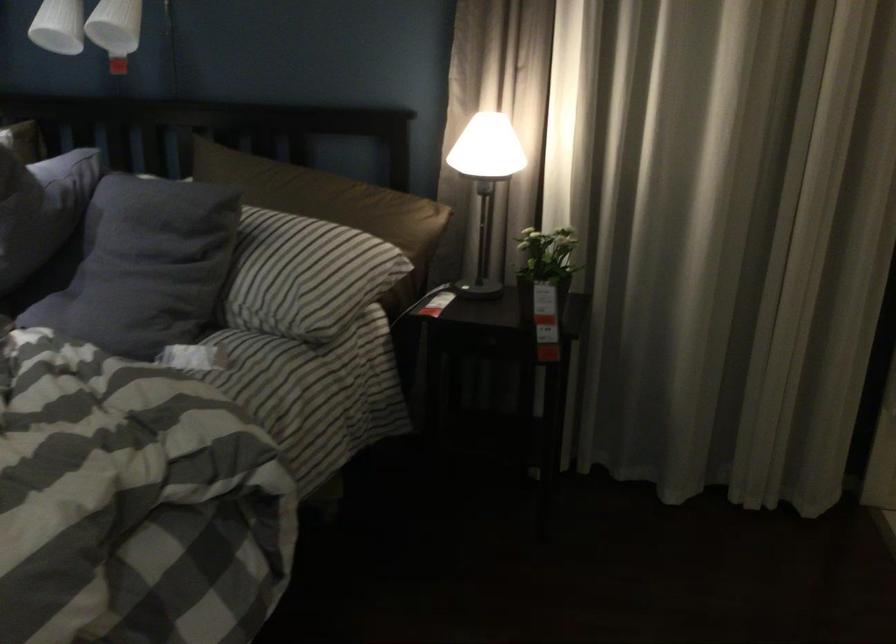
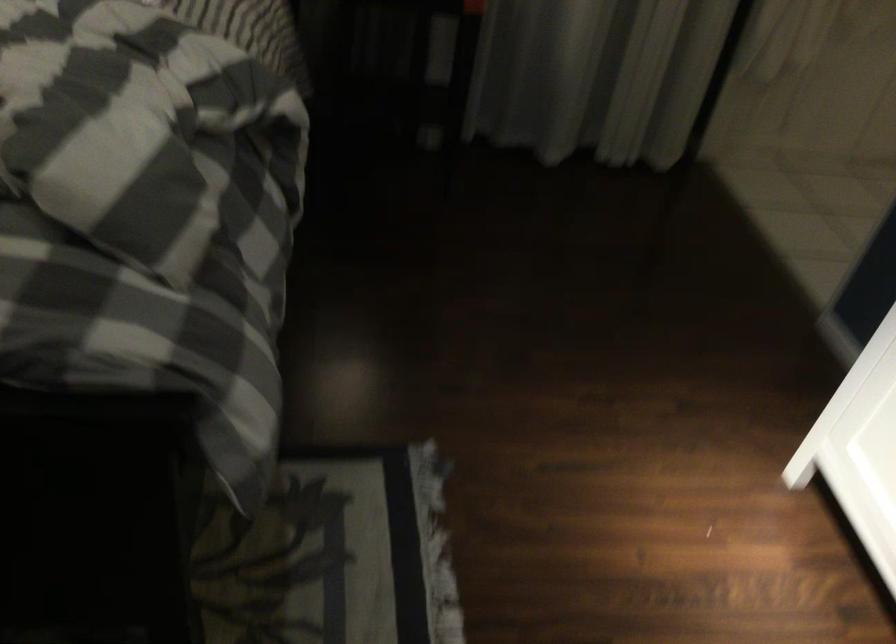
The first image is from the beginning of the video and the second image is from the end. How did the camera likely rotate when shooting the video?

The rotation direction of the camera is right-down.